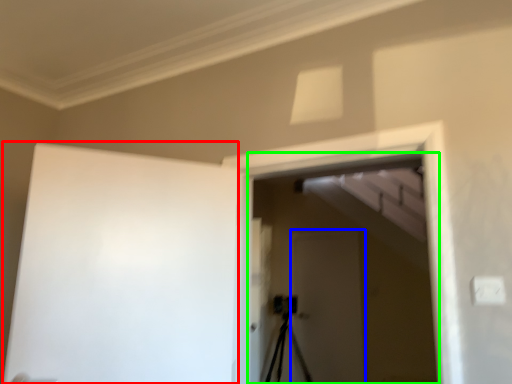
Question: Based on their relative distances, which object is farther from barn door (highlighted by a red box)? Choose from screen door (highlighted by a blue box) and screen door (highlighted by a green box).

Choices:
 (A) screen door
 (B) screen door

Answer: (A)